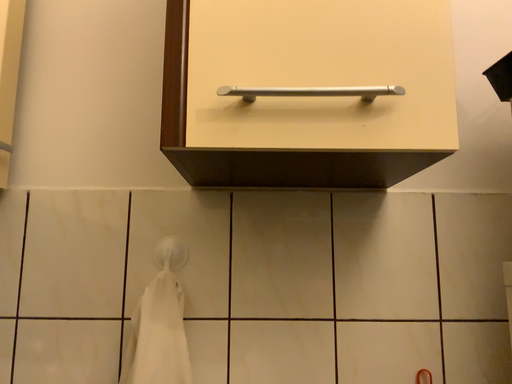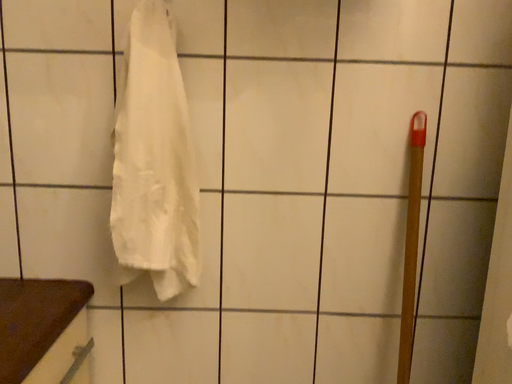
Question: How did the camera likely rotate when shooting the video?

Choices:
 (A) rotated upward
 (B) rotated downward

Answer: (B)